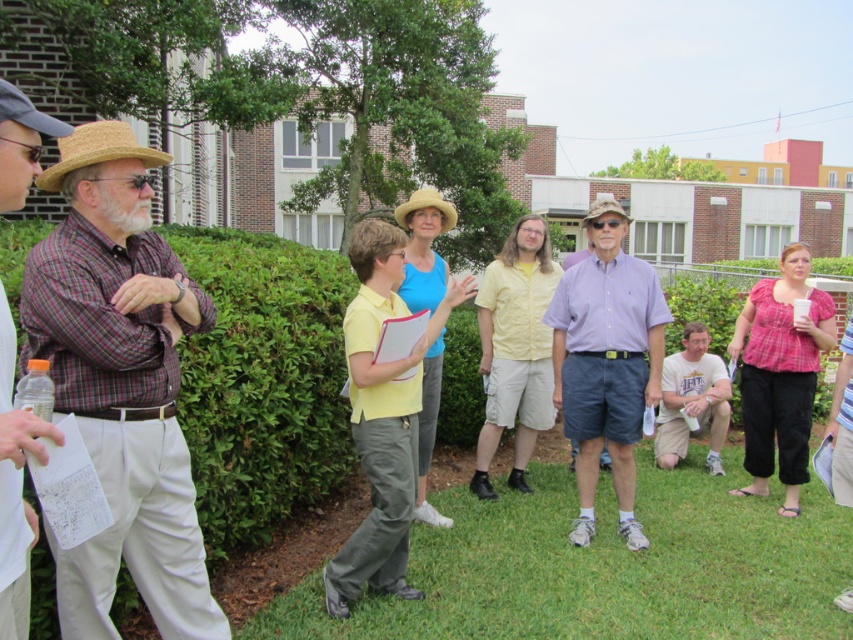
From the picture: Which is above, green grass at lower center or straw hat at center?

straw hat at center is higher up.

Who is more forward, (793,563) or (596,209)?

Point (793,563) is more forward.

Measure the distance between point (437, 556) and camera.

15.50 feet

Where is `green grass at lower center`? The height and width of the screenshot is (640, 853). green grass at lower center is located at coordinates (606, 566).

Can you confirm if light yellow straw hat at center is positioned to the right of straw hat at center?

In fact, light yellow straw hat at center is to the left of straw hat at center.

Does point (399, 221) come behind point (608, 208)?

Yes.

Identify the location of light yellow straw hat at center. The image size is (853, 640). (425, 208).

Image resolution: width=853 pixels, height=640 pixels. I want to click on light yellow straw hat at center, so (425, 208).

From the picture: Measure the distance between straw hat at upper left and camera.

A distance of 6.44 feet exists between straw hat at upper left and camera.

Is straw hat at upper left taller than straw hat at center?

In fact, straw hat at upper left may be shorter than straw hat at center.

Is point (33, 115) behind point (607, 208)?

No.

This screenshot has height=640, width=853. Find the location of `straw hat at upper left`. straw hat at upper left is located at coordinates (27, 113).